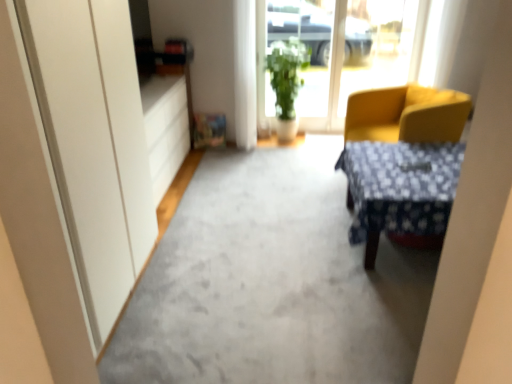
The height and width of the screenshot is (384, 512). What do you see at coordinates (399, 189) in the screenshot? I see `blue fabric desk at center` at bounding box center [399, 189].

This screenshot has width=512, height=384. I want to click on blue fabric desk at center, so click(x=399, y=189).

This screenshot has width=512, height=384. I want to click on transparent glass window at center, so (x=349, y=50).

The image size is (512, 384). Describe the element at coordinates (349, 50) in the screenshot. I see `transparent glass window at center` at that location.

This screenshot has width=512, height=384. Identify the location of green leafy plant at center. (287, 82).

At what (x,y) coordinates should I click in order to perform the action: click on gray carpet at center. Please return your answer as a coordinate pair (x, y). Image resolution: width=512 pixels, height=384 pixels. Looking at the image, I should click on (271, 283).

This screenshot has height=384, width=512. What do you see at coordinates (162, 105) in the screenshot?
I see `matte white drawer at left` at bounding box center [162, 105].

Locate an element on the screen. blue fabric desk at center is located at coordinates (399, 189).

Considering the relative positions of transparent glass window at center and matte white drawer at left in the image provided, is transparent glass window at center to the right of matte white drawer at left from the viewer's perspective?

Yes, transparent glass window at center is to the right of matte white drawer at left.

Which object is wider, transparent glass window at center or matte white drawer at left?

matte white drawer at left is wider.

From the image's perspective, which is above, transparent glass window at center or matte white drawer at left?

transparent glass window at center is shown above in the image.

Would you say transparent glass window at center is outside matte white drawer at left?

That's correct, transparent glass window at center is outside of matte white drawer at left.

Can you confirm if transparent glass window at center is positioned to the left of green leafy plant at center?

No.

Are transparent glass window at center and green leafy plant at center located far from each other?

That's not correct — transparent glass window at center is a little close to green leafy plant at center.

The image size is (512, 384). Identify the location of window screen lying behind the green leafy plant at center. (349, 50).

From the picture: Can you confirm if transparent glass window at center is bigger than green leafy plant at center?

Incorrect, transparent glass window at center is not larger than green leafy plant at center.

Considering the relative positions of matte white drawer at left and blue fabric desk at center in the image provided, is matte white drawer at left behind blue fabric desk at center?

Yes, matte white drawer at left is further from the viewer.

Which object is thinner, matte white drawer at left or blue fabric desk at center?

With smaller width is matte white drawer at left.

In the image, is matte white drawer at left on the left side or the right side of blue fabric desk at center?

matte white drawer at left is positioned on blue fabric desk at center's left side.

Is white glossy screen door at upper center closer to camera compared to transparent glass window at center?

Yes, white glossy screen door at upper center is in front of transparent glass window at center.

Based on the photo, from a real-world perspective, does white glossy screen door at upper center stand above transparent glass window at center?

Yes, from a real-world perspective, white glossy screen door at upper center is above transparent glass window at center.

Is white glossy screen door at upper center oriented away from transparent glass window at center?

No.

Image resolution: width=512 pixels, height=384 pixels. Identify the location of chair located behind the gray carpet at center. (407, 115).

Between yellow fabric chair at right and gray carpet at center, which one has larger width?

gray carpet at center is wider.

Measure the distance from yellow fabric chair at right to gray carpet at center.

yellow fabric chair at right and gray carpet at center are 1.26 meters apart from each other.

Is the depth of yellow fabric chair at right greater than that of gray carpet at center?

Yes, it is.

From the image's perspective, is white glossy screen door at upper center positioned above or below yellow fabric chair at right?

From the image's perspective, white glossy screen door at upper center appears below yellow fabric chair at right.

Is white glossy screen door at upper center facing away from yellow fabric chair at right?

No, white glossy screen door at upper center is not facing away from yellow fabric chair at right.

Considering the relative sizes of white glossy screen door at upper center and yellow fabric chair at right in the image provided, is white glossy screen door at upper center wider than yellow fabric chair at right?

In fact, white glossy screen door at upper center might be narrower than yellow fabric chair at right.

Between gray carpet at center and green leafy plant at center, which one has more height?

With more height is green leafy plant at center.

Would you consider gray carpet at center to be distant from green leafy plant at center?

That's right, there is a large distance between gray carpet at center and green leafy plant at center.

Is gray carpet at center inside or outside of green leafy plant at center?

gray carpet at center exists outside the volume of green leafy plant at center.

How many degrees apart are the facing directions of gray carpet at center and green leafy plant at center?

There is a 0.63-degree angle between the facing directions of gray carpet at center and green leafy plant at center.

Identify the location of drawer below the transparent glass window at center (from a real-world perspective). The width and height of the screenshot is (512, 384). (162, 105).

In order to click on window screen located above the green leafy plant at center (from the image's perspective) in this screenshot , I will do `click(349, 50)`.

Looking at the image, which one is located closer to matte white drawer at left, yellow fabric chair at right or transparent glass window at center?

yellow fabric chair at right is closer to matte white drawer at left.

Estimate the real-world distances between objects in this image. Which object is further from blue fabric desk at center, green leafy plant at center or gray carpet at center?

green leafy plant at center.

Looking at the image, which one is located closer to green leafy plant at center, white glossy screen door at upper center or transparent glass window at center?

The object closer to green leafy plant at center is transparent glass window at center.

Based on their spatial positions, is white glossy screen door at upper center or matte white drawer at left closer to yellow fabric chair at right?

matte white drawer at left is closer to yellow fabric chair at right.

Which object lies further to the anchor point green leafy plant at center, blue fabric desk at center or white glossy screen door at upper center?

Based on the image, white glossy screen door at upper center appears to be further to green leafy plant at center.

Looking at this image, estimate the real-world distances between objects in this image. Which object is further from green leafy plant at center, white glossy screen door at upper center or gray carpet at center?

white glossy screen door at upper center is positioned further to the anchor green leafy plant at center.

Considering their positions, is green leafy plant at center positioned further to matte white drawer at left than blue fabric desk at center?

blue fabric desk at center is positioned further to the anchor matte white drawer at left.

When comparing their distances from yellow fabric chair at right, does blue fabric desk at center or gray carpet at center seem further?

gray carpet at center is positioned further to the anchor yellow fabric chair at right.

Locate an element on the screen. houseplant between matte white drawer at left and transparent glass window at center from left to right is located at coordinates (287, 82).

Locate an element on the screen. The width and height of the screenshot is (512, 384). chair between white glossy screen door at upper center and green leafy plant at center from front to back is located at coordinates (407, 115).

You are a GUI agent. You are given a task and a screenshot of the screen. Output one action in this format:
    pyautogui.click(x=<x>, y=<y>)
    Task: Click on the houseplant located between yellow fabric chair at right and transparent glass window at center in the depth direction
    This screenshot has width=512, height=384.
    Given the screenshot: What is the action you would take?
    pyautogui.click(x=287, y=82)

The width and height of the screenshot is (512, 384). In order to click on drawer between gray carpet at center and transparent glass window at center along the z-axis in this screenshot , I will do `click(162, 105)`.